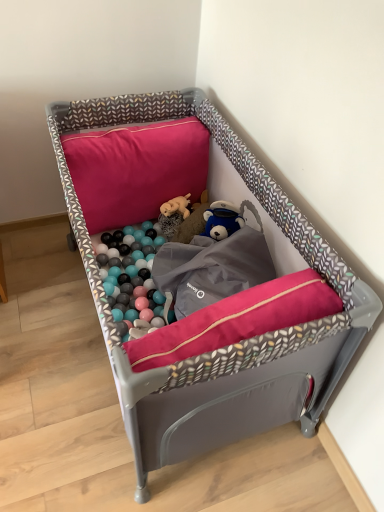
Question: Is fluffy beige stuffed animal at center taller than pink fabric pillow at upper center?

Choices:
 (A) no
 (B) yes

Answer: (A)

Question: Is fluffy beige stuffed animal at center with pink fabric pillow at upper center?

Choices:
 (A) yes
 (B) no

Answer: (B)

Question: From a real-world perspective, is fluffy beige stuffed animal at center positioned over pink fabric pillow at upper center based on gravity?

Choices:
 (A) yes
 (B) no

Answer: (B)

Question: Is fluffy beige stuffed animal at center closer to the viewer compared to pink fabric pillow at upper center?

Choices:
 (A) yes
 (B) no

Answer: (B)

Question: Can pink fabric pillow at upper center be found inside fluffy beige stuffed animal at center?

Choices:
 (A) yes
 (B) no

Answer: (B)

Question: Is fluffy beige stuffed animal at center wider or thinner than matte gray playpen at center?

Choices:
 (A) wide
 (B) thin

Answer: (B)

Question: From the image's perspective, is fluffy beige stuffed animal at center positioned above or below matte gray playpen at center?

Choices:
 (A) below
 (B) above

Answer: (B)

Question: In terms of height, does fluffy beige stuffed animal at center look taller or shorter compared to matte gray playpen at center?

Choices:
 (A) short
 (B) tall

Answer: (A)

Question: Considering the positions of point (163, 210) and point (345, 286), is point (163, 210) closer or farther from the camera than point (345, 286)?

Choices:
 (A) farther
 (B) closer

Answer: (A)

Question: Considering the positions of matte gray playpen at center and pink fabric pillow at upper center in the image, is matte gray playpen at center taller or shorter than pink fabric pillow at upper center?

Choices:
 (A) tall
 (B) short

Answer: (A)

Question: Is matte gray playpen at center inside or outside of pink fabric pillow at upper center?

Choices:
 (A) outside
 (B) inside

Answer: (A)

Question: Would you say matte gray playpen at center is to the left or to the right of pink fabric pillow at upper center in the picture?

Choices:
 (A) right
 (B) left

Answer: (A)

Question: Looking at the image, does matte gray playpen at center seem bigger or smaller compared to pink fabric pillow at upper center?

Choices:
 (A) big
 (B) small

Answer: (A)

Question: Looking at their shapes, would you say fluffy beige stuffed animal at center is wider or thinner than pink fabric pillow at upper center?

Choices:
 (A) wide
 (B) thin

Answer: (B)

Question: From the image's perspective, relative to pink fabric pillow at upper center, is fluffy beige stuffed animal at center above or below?

Choices:
 (A) below
 (B) above

Answer: (A)